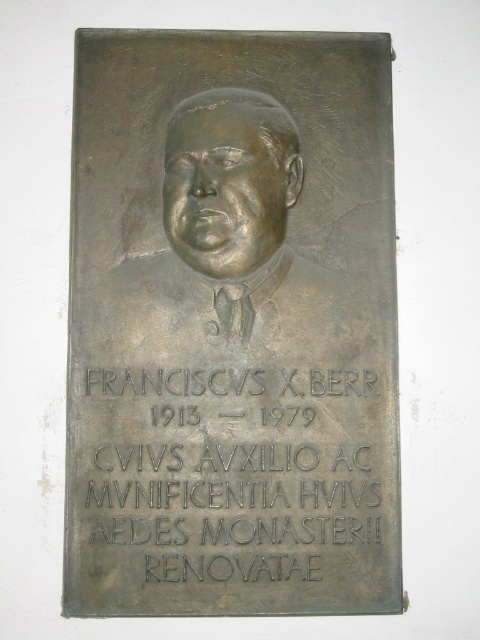
The width and height of the screenshot is (480, 640). What do you see at coordinates (231, 326) in the screenshot? I see `bronze relief at center` at bounding box center [231, 326].

Does bronze relief at center appear over bronze engraving at center?

Yes, bronze relief at center is above bronze engraving at center.

This screenshot has height=640, width=480. I want to click on bronze relief at center, so click(231, 326).

This screenshot has width=480, height=640. Identify the location of bronze relief at center. (231, 326).

Is bronze relief at center closer to camera compared to bronze relief bust at center?

No, it is behind bronze relief bust at center.

Which is below, bronze relief at center or bronze relief bust at center?

bronze relief at center is below.

Locate an element on the screen. The height and width of the screenshot is (640, 480). bronze relief at center is located at coordinates click(231, 326).

Is point (355, 502) farther from camera compared to point (290, 352)?

No.

Does bronze engraving at center have a larger size compared to bronze relief bust at center?

No, bronze engraving at center is not bigger than bronze relief bust at center.

Is point (358, 397) closer to camera compared to point (196, 264)?

No, (358, 397) is further to viewer.

You are a GUI agent. You are given a task and a screenshot of the screen. Output one action in this format:
    pyautogui.click(x=<x>, y=<y>)
    Task: Click on the bronze engraving at center
    Image resolution: width=480 pixels, height=640 pixels.
    Given the screenshot: What is the action you would take?
    pyautogui.click(x=233, y=456)